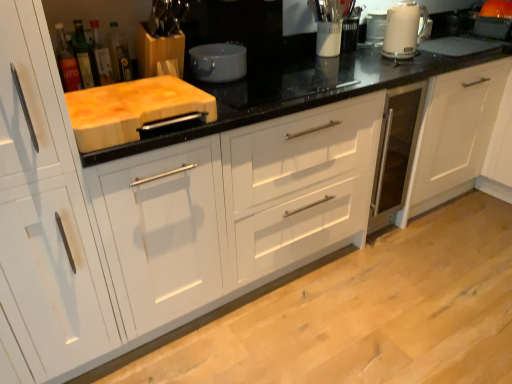
Question: In the image, is translucent glass bottle at upper left, which is the first bottle in left-to-right order, positioned in front of or behind translucent glass bottle at upper left, arranged as the first bottle when viewed from the right?

Choices:
 (A) front
 (B) behind

Answer: (A)

Question: From their relative heights in the image, would you say translucent glass bottle at upper left, which is the first bottle in left-to-right order, is taller or shorter than translucent glass bottle at upper left, arranged as the first bottle when viewed from the right?

Choices:
 (A) short
 (B) tall

Answer: (B)

Question: Which is farther from the white glossy kettle at upper right?

Choices:
 (A) green glass bottle at upper left, the 3th bottle when ordered from right to left
 (B) natural wood cutting board at left
 (C) translucent glass bottle at upper left, which ranks as the fourth bottle in right-to-left order
 (D) matte gray pot at center
 (E) white glossy electric kettle at upper right

Answer: (C)

Question: Based on their relative distances, which object is nearer to the matte gray pot at center?

Choices:
 (A) translucent glass bottle at upper left, arranged as the first bottle when viewed from the right
 (B) natural wood cutting board at left
 (C) translucent glass bottle at upper left, which is the first bottle in left-to-right order
 (D) white glossy kettle at upper right
 (E) green glass bottle at upper left, the 3th bottle when ordered from right to left

Answer: (A)